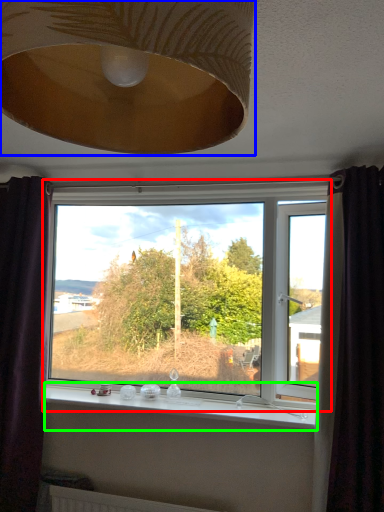
Question: Based on their relative distances, which object is nearer to window (highlighted by a red box)? Choose from lamp (highlighted by a blue box) and window sill (highlighted by a green box).

Choices:
 (A) lamp
 (B) window sill

Answer: (B)